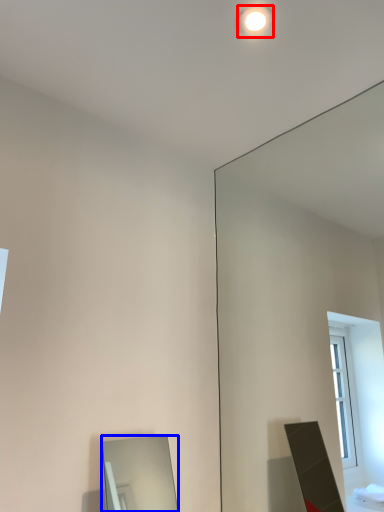
Question: Which point is further to the camera, lighting (highlighted by a red box) or mirror (highlighted by a blue box)?

Choices:
 (A) lighting
 (B) mirror

Answer: (A)